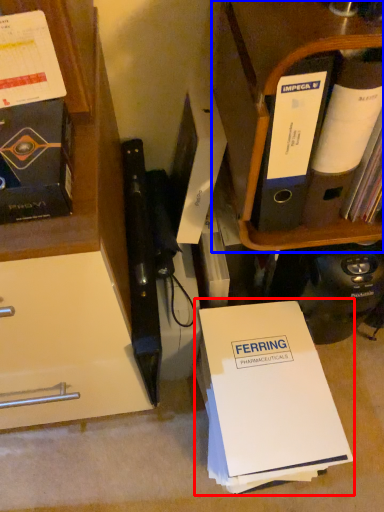
Question: Which of the following is the farthest to the observer, paperback book (highlighted by a red box) or shelf (highlighted by a blue box)?

Choices:
 (A) paperback book
 (B) shelf

Answer: (A)